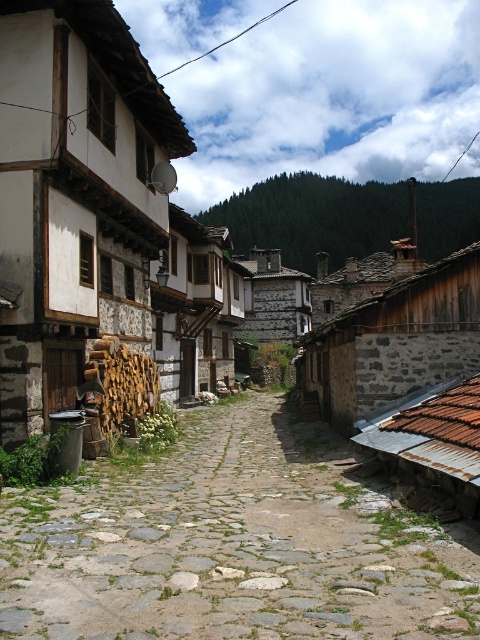
Measure the distance between rustic stone hut at center and stone textured hut at center.

rustic stone hut at center and stone textured hut at center are 28.99 meters apart from each other.

Is rustic stone hut at center to the right of stone textured hut at center from the viewer's perspective?

Indeed, rustic stone hut at center is positioned on the right side of stone textured hut at center.

Identify the location of rustic stone hut at center. (396, 340).

At what (x,y) coordinates should I click in order to perform the action: click on rustic stone hut at center. Please return your answer as a coordinate pair (x, y). Looking at the image, I should click on [x=396, y=340].

Is natural stone cobblestone path at center positioned before rustic stone hut at center?

Yes.

Is natural stone cobblestone path at center thinner than rustic stone hut at center?

No.

Locate an element on the screen. natural stone cobblestone path at center is located at coordinates (232, 545).

Where is `natural stone cobblestone path at center`? The width and height of the screenshot is (480, 640). natural stone cobblestone path at center is located at coordinates (232, 545).

This screenshot has width=480, height=640. I want to click on wooden log pile at left, so (x=74, y=196).

Does wooden log pile at left have a larger size compared to stone textured hut at center?

Actually, wooden log pile at left might be smaller than stone textured hut at center.

Does point (7, 241) lie in front of point (260, 292)?

That is True.

You are a GUI agent. You are given a task and a screenshot of the screen. Output one action in this format:
    pyautogui.click(x=<x>, y=<y>)
    Task: Click on the wooden log pile at left
    The image size is (480, 640).
    Given the screenshot: What is the action you would take?
    pyautogui.click(x=74, y=196)